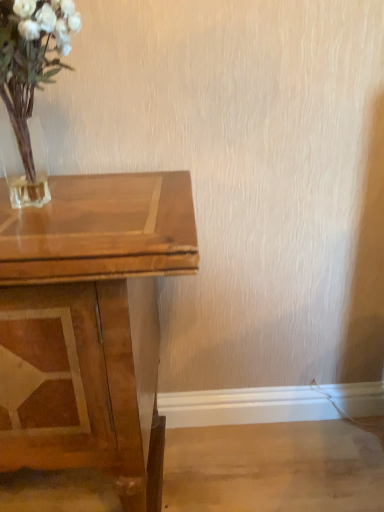
This screenshot has height=512, width=384. What are the coordinates of `space that is in front of translucent glass vase at upper left` in the screenshot? It's located at coord(57,238).